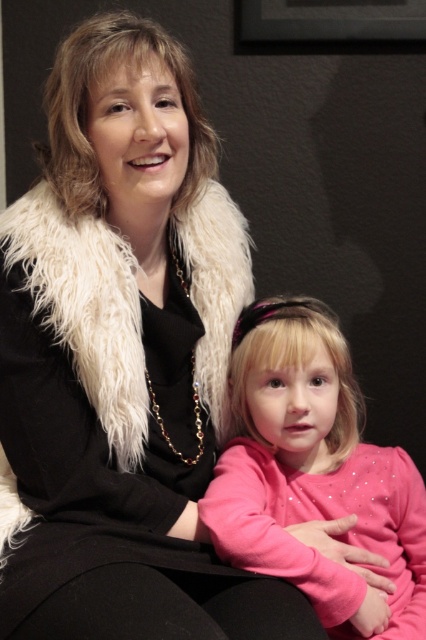
Question: Is pink glittery sweater at center wider than white fluffy fur coat at upper left?

Choices:
 (A) no
 (B) yes

Answer: (A)

Question: Is pink glittery sweater at center above white fluffy fur coat at upper left?

Choices:
 (A) yes
 (B) no

Answer: (B)

Question: Which point is farther to the camera?

Choices:
 (A) pink glittery sweater at center
 (B) white fluffy fur coat at upper left

Answer: (A)

Question: Is pink glittery sweater at center positioned in front of white fluffy fur coat at upper left?

Choices:
 (A) yes
 (B) no

Answer: (B)